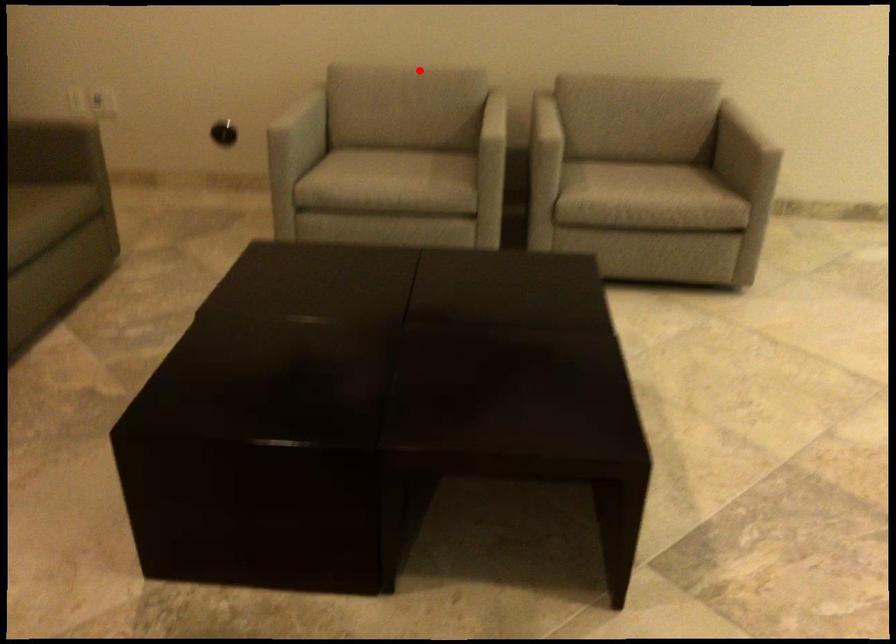
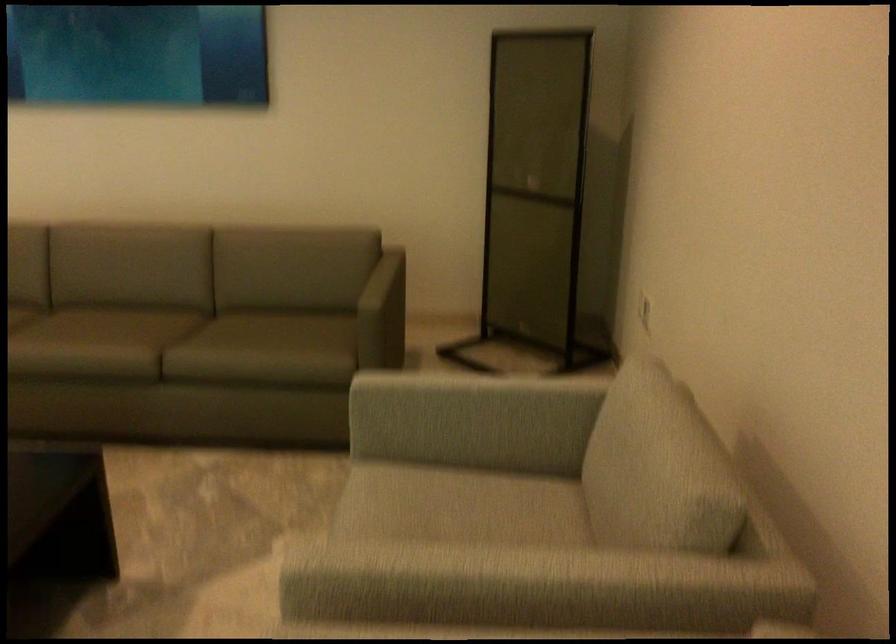
Question: I am providing you with two images of the same scene from different viewpoints. In image1, a red point is highlighted. Considering the same 3D point in image2, which of the following is correct?

Choices:
 (A) It is closer
 (B) It is farther

Answer: (A)